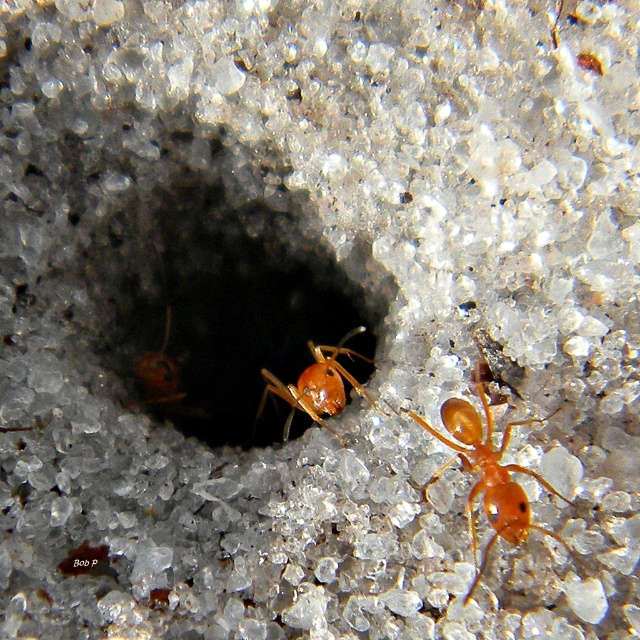
You are an entomologist observing two ants in a sandy environment. You notice the shiny orange ant at center and the orange glossy ant at center. Which ant is bigger?

The shiny orange ant at center is larger in size compared to the orange glossy ant at center.

You are a robotic explorer on a sandy terrain. Your mission is to collect samples from the shiny orange ant at center. The smooth sand hole at center is in your path. Can you safely navigate around the hole to reach the ant without getting too close?

The distance between the smooth sand hole at center and the shiny orange ant at center is 5.25 inches. Since the hole is in your path, you can navigate around it as long as you maintain a safe distance. However, you need to ensure that your path allows you to reach the ant without obstruction. The 5.25 inches provides enough space to maneuver around the hole while still reaching the ant.

You are an entomologist observing the ants. You notice the shiny orange ant at center is moving towards the smooth sand hole at center. Based on their positions, which direction should the ant turn to reach the hole?

The smooth sand hole at center is to the left of the shiny orange ant at center, so the ant should turn left to reach the hole.